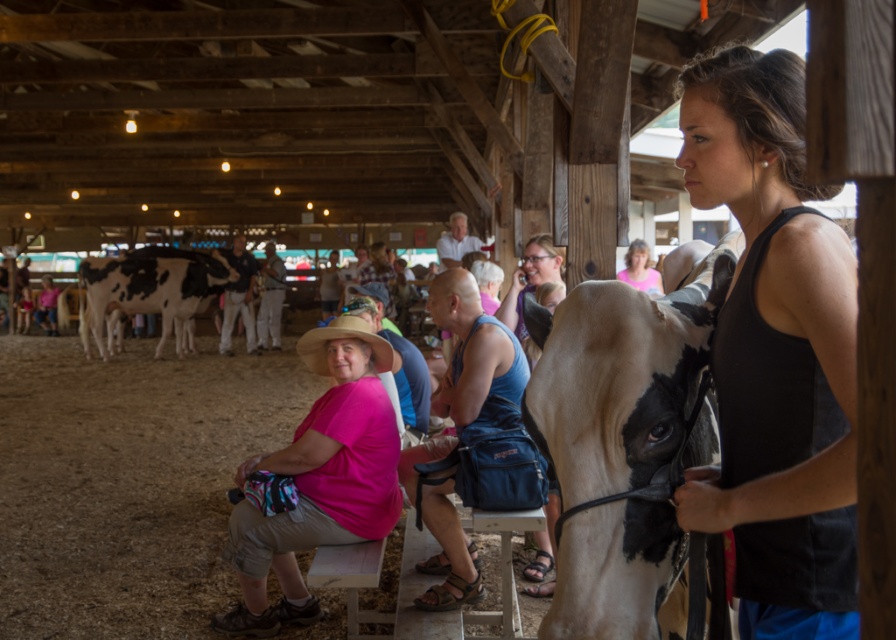
Which is more to the left, pink fabric shirt at center or white and black spotted cow at left?

white and black spotted cow at left is more to the left.

Describe the element at coordinates (319, 480) in the screenshot. I see `pink fabric shirt at center` at that location.

Where is `pink fabric shirt at center`? pink fabric shirt at center is located at coordinates (319, 480).

You are a GUI agent. You are given a task and a screenshot of the screen. Output one action in this format:
    pyautogui.click(x=<x>, y=<y>)
    Task: Click on the black matte tank top at center
    This screenshot has width=896, height=640.
    Given the screenshot: What is the action you would take?
    pyautogui.click(x=774, y=355)

The height and width of the screenshot is (640, 896). Describe the element at coordinates (774, 355) in the screenshot. I see `black matte tank top at center` at that location.

At what (x,y) coordinates should I click in order to perform the action: click on black matte tank top at center. Please return your answer as a coordinate pair (x, y). This screenshot has width=896, height=640. Looking at the image, I should click on (774, 355).

Who is positioned more to the left, white glossy cow at center or white and black spotted cow at left?

Positioned to the left is white and black spotted cow at left.

Does white glossy cow at center appear on the left side of white and black spotted cow at left?

Incorrect, white glossy cow at center is not on the left side of white and black spotted cow at left.

Where is `white glossy cow at center`? This screenshot has height=640, width=896. white glossy cow at center is located at coordinates (621, 444).

Where is `white glossy cow at center`? The height and width of the screenshot is (640, 896). white glossy cow at center is located at coordinates (621, 444).